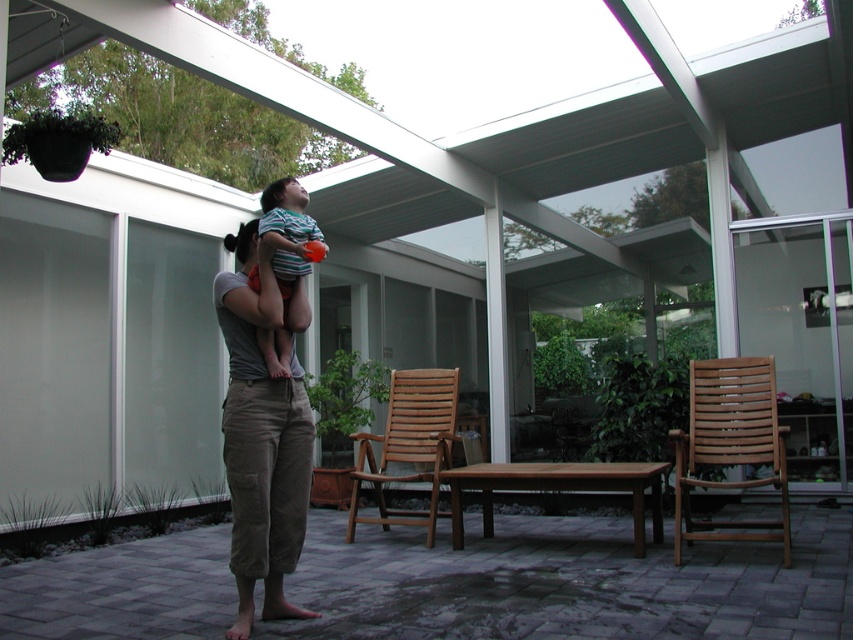
Question: Which of the following is the farthest from the observer?

Choices:
 (A) khaki cotton pants at center
 (B) striped cotton shirt at center

Answer: (A)

Question: Can you confirm if khaki cotton pants at center is wider than striped cotton shirt at center?

Choices:
 (A) yes
 (B) no

Answer: (A)

Question: Can you confirm if khaki cotton pants at center is positioned to the left of striped cotton shirt at center?

Choices:
 (A) no
 (B) yes

Answer: (B)

Question: From the image, what is the correct spatial relationship of khaki cotton pants at center in relation to striped cotton shirt at center?

Choices:
 (A) right
 (B) left

Answer: (B)

Question: Which of the following is the closest to the observer?

Choices:
 (A) khaki cotton pants at center
 (B) striped cotton shirt at center

Answer: (B)